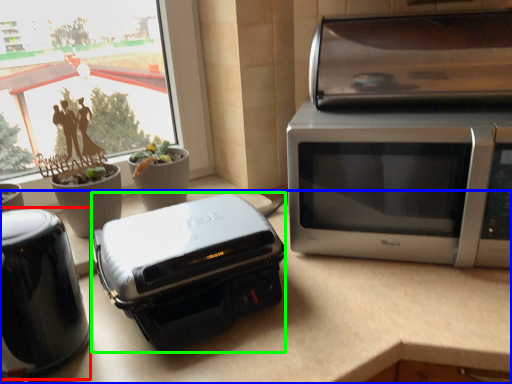
Question: Based on their relative distances, which object is farther from home appliance (highlighted by a red box)? Choose from counter top (highlighted by a blue box) and toaster (highlighted by a green box).

Choices:
 (A) counter top
 (B) toaster

Answer: (A)